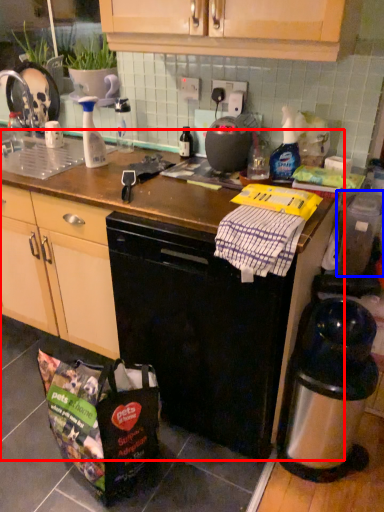
Question: Which of the following is the farthest to the observer, counter top (highlighted by a red box) or appliance (highlighted by a blue box)?

Choices:
 (A) counter top
 (B) appliance

Answer: (B)